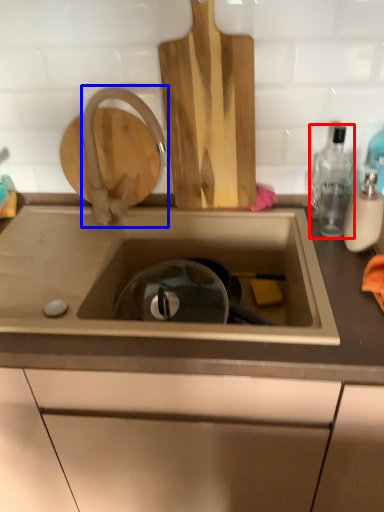
Question: Which object appears closest to the camera in this image, bottle (highlighted by a red box) or tap (highlighted by a blue box)?

Choices:
 (A) bottle
 (B) tap

Answer: (A)